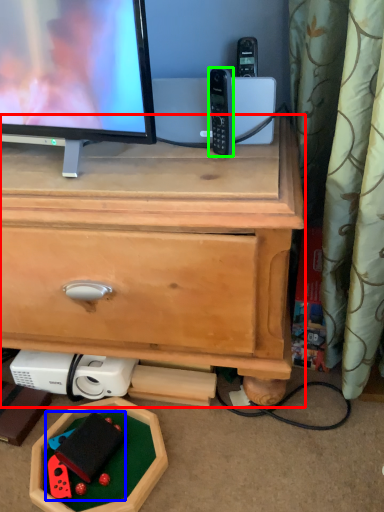
Question: Which object is the farthest from chest of drawers (highlighted by a red box)? Choose among these: toy (highlighted by a blue box) or gadget (highlighted by a green box).

Choices:
 (A) toy
 (B) gadget

Answer: (A)